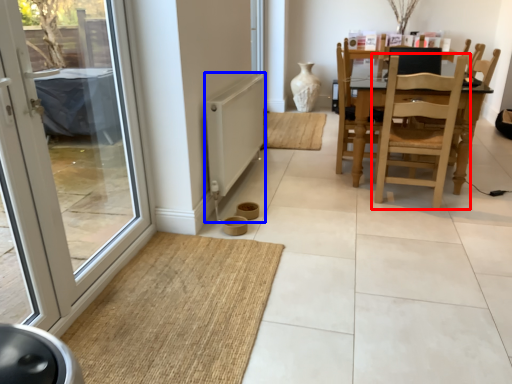
Question: Which object appears farthest to the camera in this image, chair (highlighted by a red box) or radiator (highlighted by a blue box)?

Choices:
 (A) chair
 (B) radiator

Answer: (A)